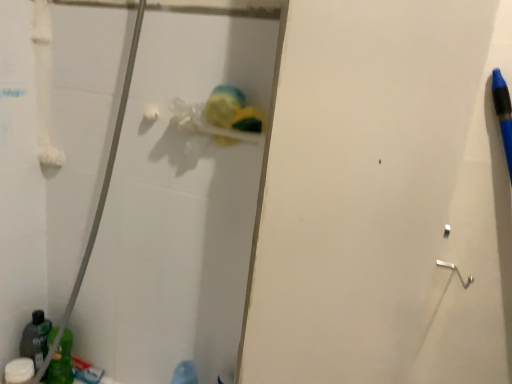
What do you see at coordinates (36, 339) in the screenshot? I see `translucent plastic bottle at lower left` at bounding box center [36, 339].

The image size is (512, 384). I want to click on translucent plastic bottle at lower left, so click(36, 339).

In order to face translucent plastic bottle at lower left, should I rotate leftwards or rightwards?

Turn left by 27.130 degrees to look at translucent plastic bottle at lower left.

Measure the distance between point [23,342] and camera.

Point [23,342] is 1.23 meters away from camera.

This screenshot has height=384, width=512. I want to click on translucent plastic bottle at lower left, so click(x=36, y=339).